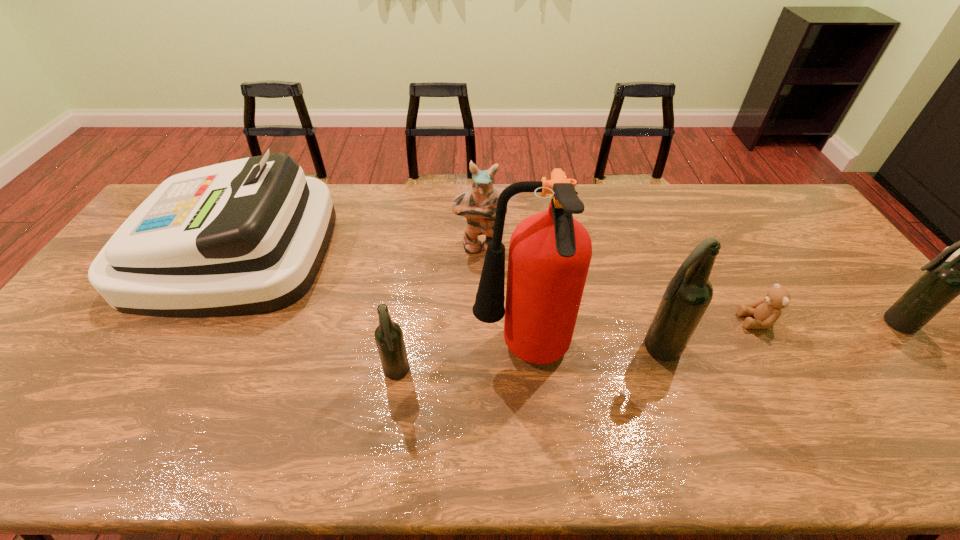
The width and height of the screenshot is (960, 540). I want to click on free point at the left edge, so click(x=78, y=327).

The width and height of the screenshot is (960, 540). Find the location of `free region at the right edge of the desktop`. free region at the right edge of the desktop is located at coordinates (812, 254).

Find the location of a particular element. The height and width of the screenshot is (540, 960). unoccupied area between the sixth object from left to right and the fire extinguisher is located at coordinates pos(639,337).

Where is `unoccupied position between the teddy bear and the leftmost beer bottle`? unoccupied position between the teddy bear and the leftmost beer bottle is located at coordinates (576, 347).

The width and height of the screenshot is (960, 540). Find the location of `vacant region between the fire extinguisher and the shortest object`. vacant region between the fire extinguisher and the shortest object is located at coordinates (639, 337).

You are a GUI agent. You are given a task and a screenshot of the screen. Output one action in this format:
    pyautogui.click(x=<x>, y=<y>)
    Task: Click on the free point between the leftmost beer bottle and the shortest object
    This screenshot has height=540, width=960.
    Given the screenshot: What is the action you would take?
    pyautogui.click(x=576, y=347)

At what (x,y) coordinates should I click in order to perform the action: click on free space between the teddy bear and the figurine. Please return your answer as a coordinate pair (x, y). The image size is (960, 540). Looking at the image, I should click on (618, 284).

Locate an element on the screen. free spot between the rightmost object and the teddy bear is located at coordinates (826, 322).

Locate an element on the screen. The height and width of the screenshot is (540, 960). free area in between the second tallest beer bottle and the shortest object is located at coordinates (826, 322).

Find the location of `empty location between the second tallest beer bottle and the tallest object`. empty location between the second tallest beer bottle and the tallest object is located at coordinates (708, 338).